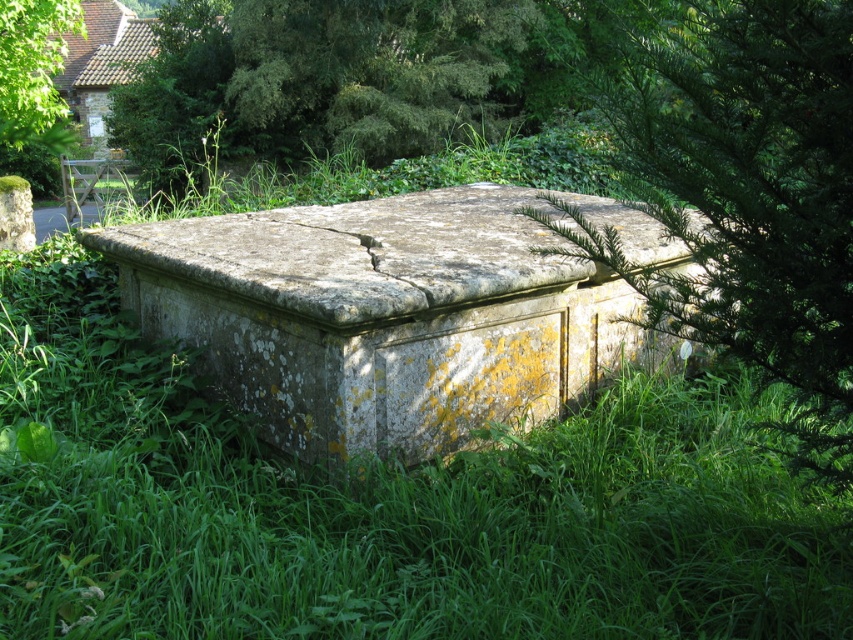
You are an archaeologist examining the sarcophagus and notice two green leafy trees in the image. One is labeled as the green leafy tree at center, and the other as the green leafy tree at upper center. Based on their positions, which tree is closer to the sarcophagus?

The green leafy tree at center is positioned under the green leafy tree at upper center, meaning the green leafy tree at center is closer to the sarcophagus.

You are an archaeologist examining the sarcophagus and notice two green leafy trees in the image. Which tree has a greater width between the green leafy tree at upper center and the green leafy tree at upper left?

The green leafy tree at upper center has a greater width than the green leafy tree at upper left.